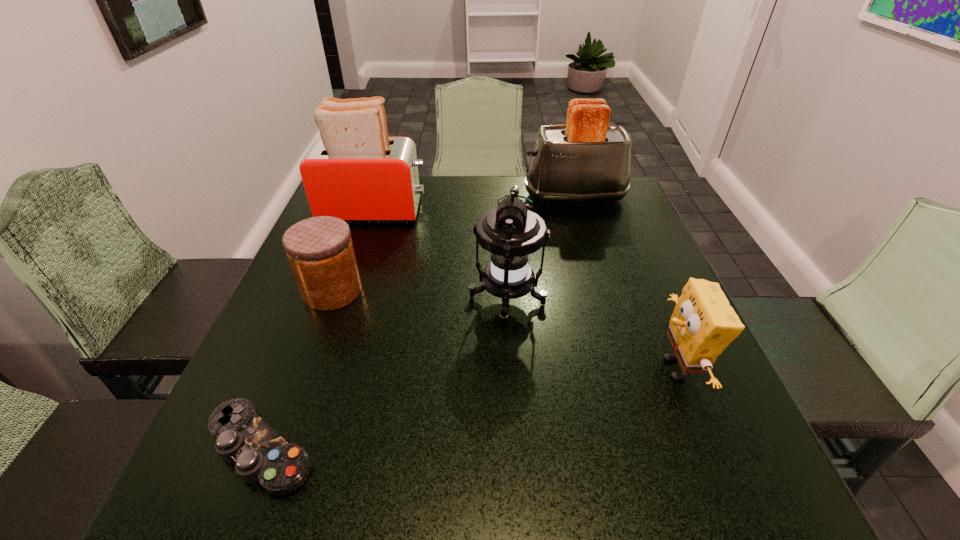
Where is `free point between the shortest object and the left toaster`? This screenshot has height=540, width=960. free point between the shortest object and the left toaster is located at coordinates (318, 329).

You are a GUI agent. You are given a task and a screenshot of the screen. Output one action in this format:
    pyautogui.click(x=<x>, y=<y>)
    Task: Click on the free space between the lantern and the jar
    The image size is (960, 540).
    Given the screenshot: What is the action you would take?
    pyautogui.click(x=420, y=296)

The width and height of the screenshot is (960, 540). In order to click on vacant space that is in between the jar and the right toaster in this screenshot , I will do `click(453, 244)`.

The height and width of the screenshot is (540, 960). In order to click on vacant region between the right toaster and the control in this screenshot , I will do `click(418, 322)`.

Where is `free space that is in between the jar and the lantern`? The image size is (960, 540). free space that is in between the jar and the lantern is located at coordinates [x=420, y=296].

Where is `free space that is in between the lantern and the right toaster`? Image resolution: width=960 pixels, height=540 pixels. free space that is in between the lantern and the right toaster is located at coordinates [x=540, y=248].

This screenshot has width=960, height=540. In order to click on vacant area that lies between the left toaster and the control in this screenshot , I will do `click(318, 329)`.

The width and height of the screenshot is (960, 540). Identify the location of free space that is in between the right toaster and the control. (418, 322).

Where is `vacant region between the lantern and the shortest object`? vacant region between the lantern and the shortest object is located at coordinates point(384,374).

You are a GUI agent. You are given a task and a screenshot of the screen. Output one action in this format:
    pyautogui.click(x=<x>, y=<y>)
    Task: Click on the blank region between the control and the left toaster
    
    Given the screenshot: What is the action you would take?
    pyautogui.click(x=318, y=329)